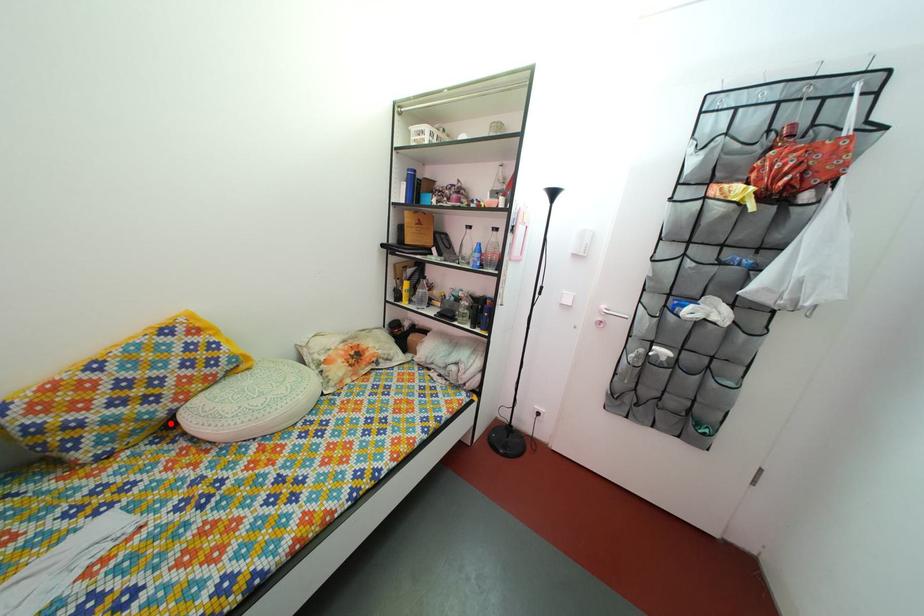
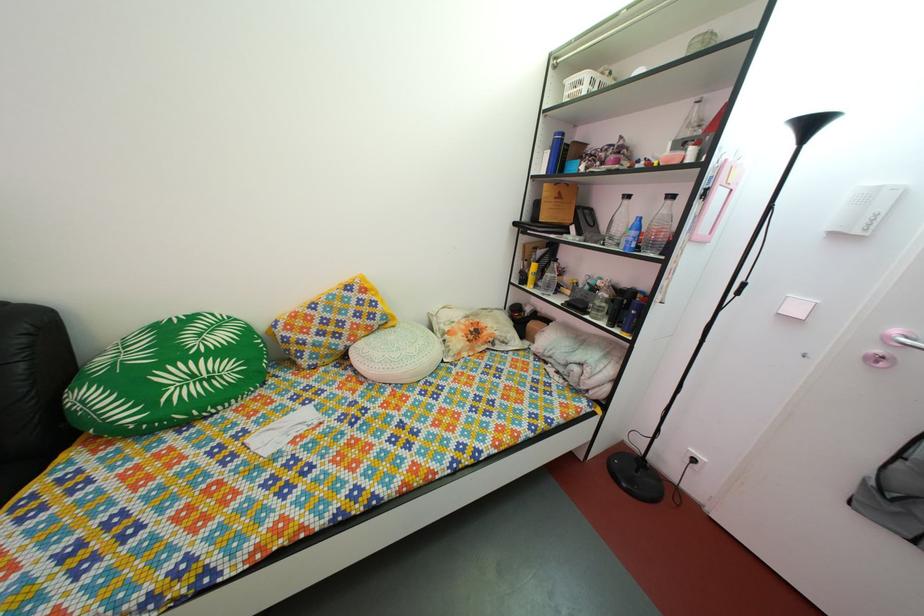
The point at the highlighted location is marked in the first image. Where is the corresponding point in the second image?

(349, 357)